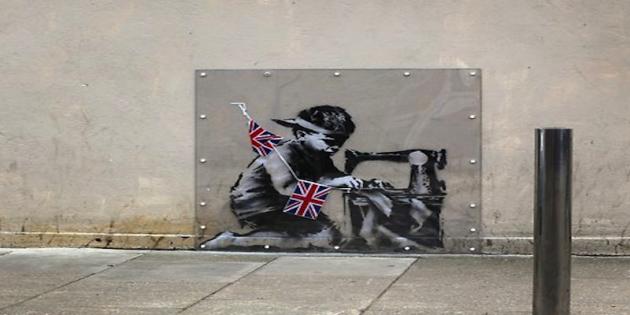
Identify the location of concrete wall. (72, 77), (550, 50).